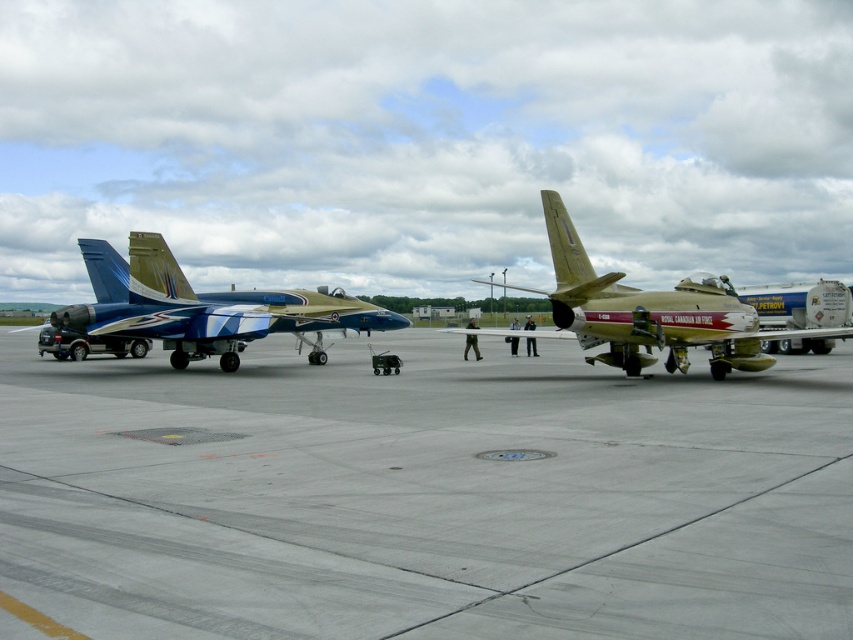
Question: Is shiny blue and white fighter jet at center to the right of matte gold airplane at center from the viewer's perspective?

Choices:
 (A) yes
 (B) no

Answer: (B)

Question: Which point appears closest to the camera in this image?

Choices:
 (A) (775, 333)
 (B) (51, 502)

Answer: (B)

Question: Is gray concrete tarmac at center thinner than shiny blue and white fighter jet at center?

Choices:
 (A) yes
 (B) no

Answer: (B)

Question: Which point appears farthest from the camera in this image?

Choices:
 (A) click(x=334, y=525)
 (B) click(x=200, y=336)
 (C) click(x=717, y=333)

Answer: (B)

Question: Which point is closer to the camera?

Choices:
 (A) (335, 305)
 (B) (577, 269)

Answer: (B)

Question: Does gray concrete tarmac at center have a smaller size compared to matte gold airplane at center?

Choices:
 (A) no
 (B) yes

Answer: (B)